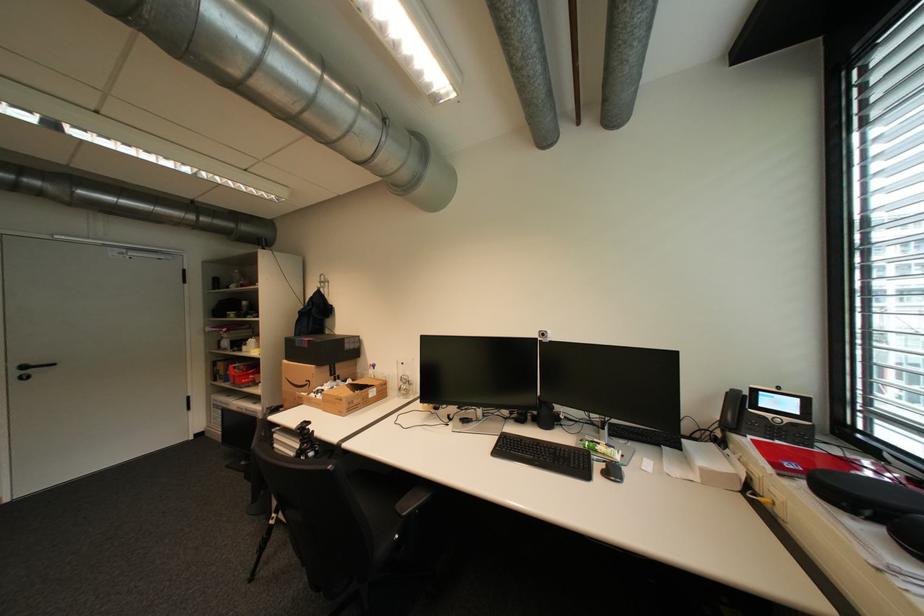
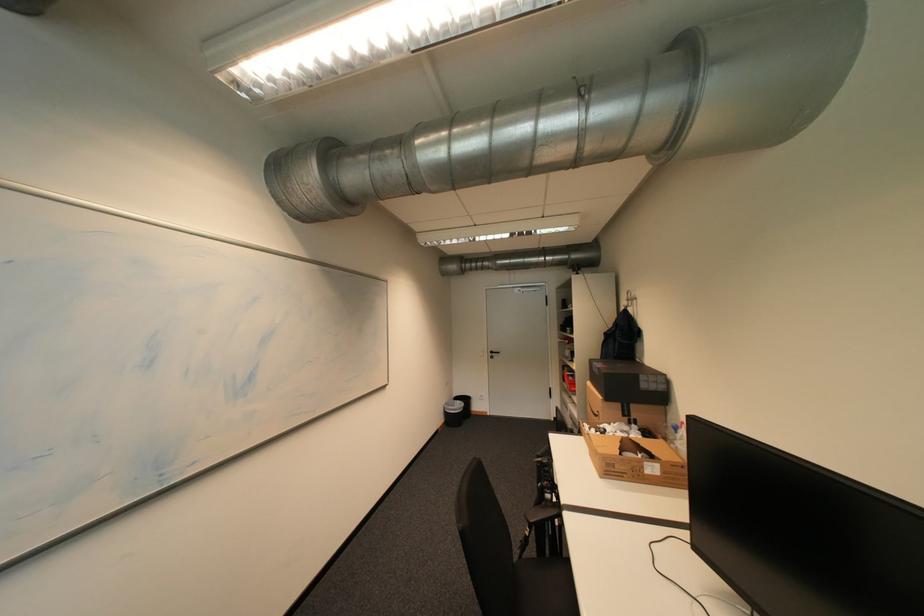
Question: Based on the continuous images, in which direction is the camera rotating? Reply with the corresponding letter.

Choices:
 (A) Left
 (B) Right
 (C) Up
 (D) Down

Answer: (A)